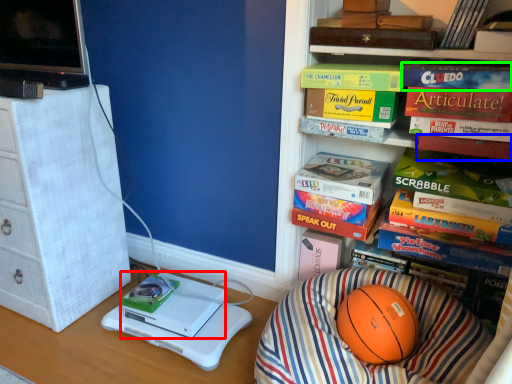
Question: Which object is the closest to the box (highlighted by a red box)? Choose among these: paperback book (highlighted by a blue box) or paperback book (highlighted by a green box).

Choices:
 (A) paperback book
 (B) paperback book

Answer: (A)